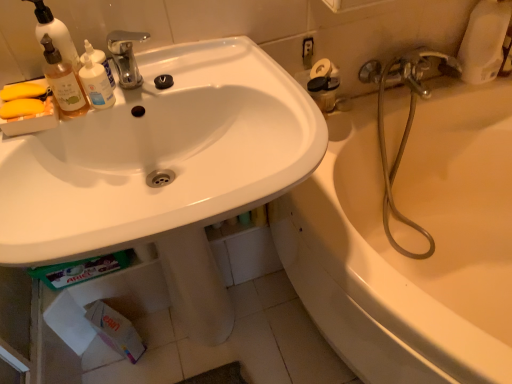
Question: Is translucent plastic bottle at upper left beside metallic hose at right, the first plumbing fixture viewed from the front?

Choices:
 (A) yes
 (B) no

Answer: (B)

Question: Is translucent plastic bottle at upper left to the right of metallic hose at right, the first plumbing fixture viewed from the front, from the viewer's perspective?

Choices:
 (A) yes
 (B) no

Answer: (B)

Question: Could metallic hose at right, acting as the second plumbing fixture starting from the back, be considered to be inside translucent plastic bottle at upper left?

Choices:
 (A) no
 (B) yes

Answer: (A)

Question: Does translucent plastic bottle at upper left have a greater width compared to metallic hose at right, the first plumbing fixture viewed from the front?

Choices:
 (A) yes
 (B) no

Answer: (B)

Question: Is translucent plastic bottle at upper left taller than metallic hose at right, the first plumbing fixture viewed from the front?

Choices:
 (A) no
 (B) yes

Answer: (A)

Question: From a real-world perspective, is white matte toilet paper at lower left positioned above or below satin nickel faucet at upper right, which is the first plumbing fixture in back-to-front order?

Choices:
 (A) above
 (B) below

Answer: (B)

Question: In terms of size, does white matte toilet paper at lower left appear bigger or smaller than satin nickel faucet at upper right, placed as the 2th plumbing fixture when sorted from front to back?

Choices:
 (A) big
 (B) small

Answer: (B)

Question: Do you think white matte toilet paper at lower left is within satin nickel faucet at upper right, which is the first plumbing fixture in back-to-front order, or outside of it?

Choices:
 (A) outside
 (B) inside

Answer: (A)

Question: In terms of height, does white matte toilet paper at lower left look taller or shorter compared to satin nickel faucet at upper right, which is the first plumbing fixture in back-to-front order?

Choices:
 (A) tall
 (B) short

Answer: (A)

Question: Looking at the image, does white matte soap dispenser at upper left seem bigger or smaller compared to polished chrome faucet at upper center?

Choices:
 (A) small
 (B) big

Answer: (A)

Question: Considering the positions of white matte soap dispenser at upper left and polished chrome faucet at upper center in the image, is white matte soap dispenser at upper left wider or thinner than polished chrome faucet at upper center?

Choices:
 (A) thin
 (B) wide

Answer: (A)

Question: Relative to polished chrome faucet at upper center, is white matte soap dispenser at upper left in front or behind?

Choices:
 (A) behind
 (B) front

Answer: (B)

Question: From a real-world perspective, is white matte soap dispenser at upper left positioned above or below polished chrome faucet at upper center?

Choices:
 (A) below
 (B) above

Answer: (B)

Question: Considering their positions, is polished chrome faucet at upper center located in front of or behind white matte soap dispenser at upper left?

Choices:
 (A) front
 (B) behind

Answer: (B)

Question: Is polished chrome faucet at upper center taller or shorter than white matte soap dispenser at upper left?

Choices:
 (A) short
 (B) tall

Answer: (A)